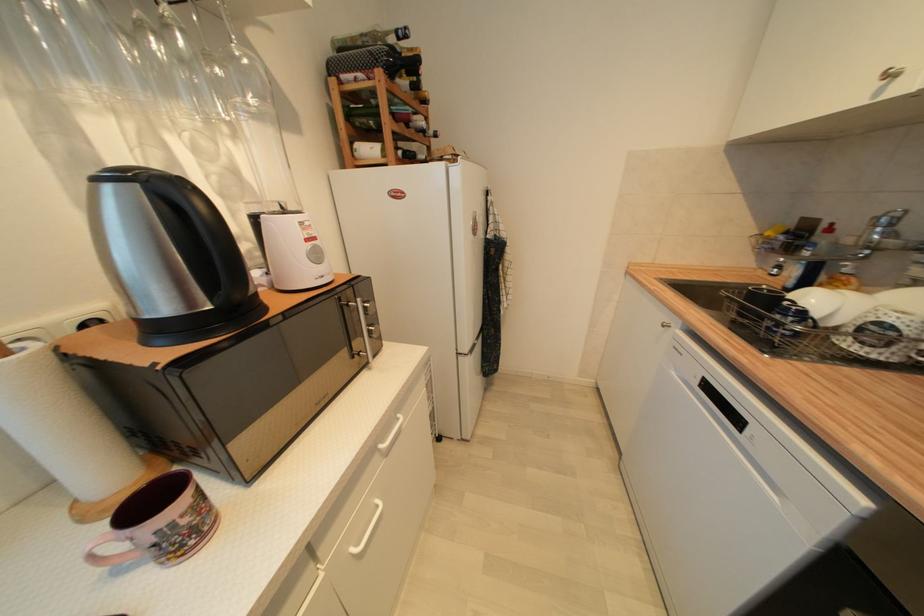
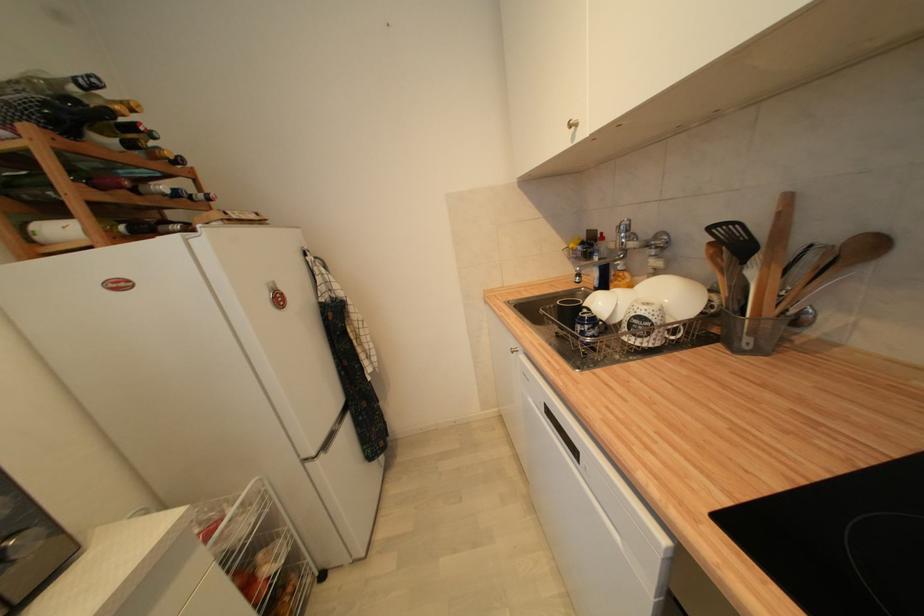
In the second image, find the point that corresponds to (x=824, y=222) in the first image.

(602, 233)